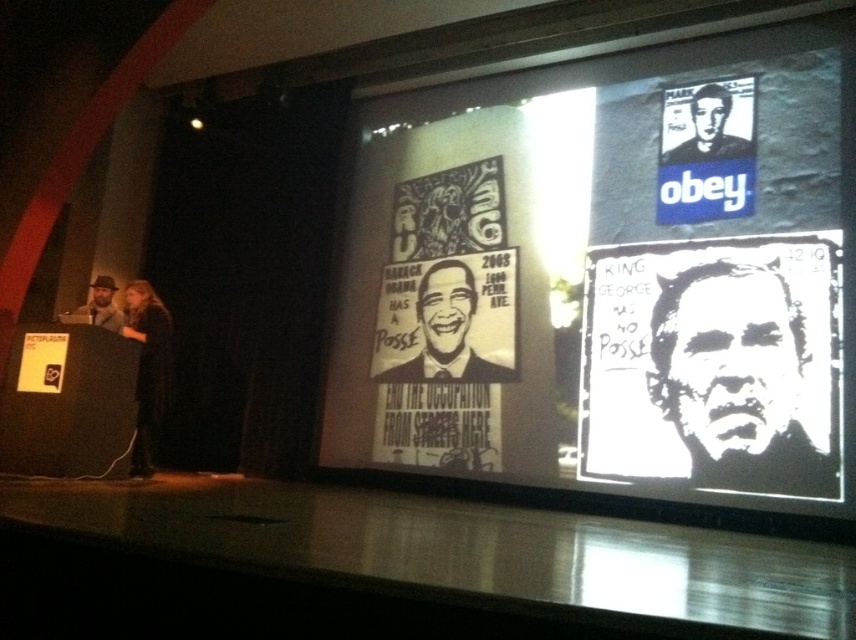
Question: Among these points, which one is farthest from the camera?

Choices:
 (A) (465, 317)
 (B) (800, 310)

Answer: (A)

Question: Which point is farther to the camera?

Choices:
 (A) (149, 442)
 (B) (450, 429)
 (C) (657, 353)
 (D) (726, 141)

Answer: (B)

Question: Which point is farther to the camera?

Choices:
 (A) black fabric dress at left
 (B) matte black hat at left
 (C) black paper at upper center
 (D) white paper at center

Answer: (B)

Question: Is white paper at center to the right of black fabric dress at left from the viewer's perspective?

Choices:
 (A) no
 (B) yes

Answer: (B)

Question: Is black paper at upper center smaller than matte black hat at left?

Choices:
 (A) no
 (B) yes

Answer: (A)

Question: Can you confirm if white paper posters at upper center is positioned to the right of white paper at center?

Choices:
 (A) yes
 (B) no

Answer: (B)